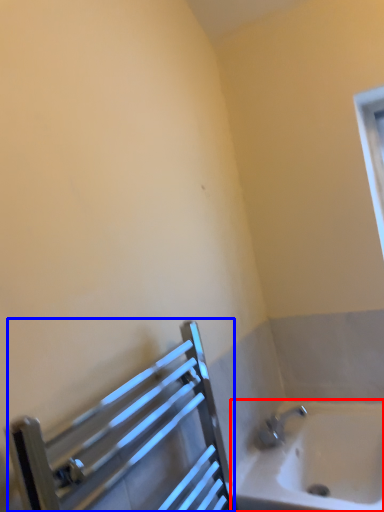
Question: Which object appears closest to the camera in this image, bathtub (highlighted by a red box) or balustrade (highlighted by a blue box)?

Choices:
 (A) bathtub
 (B) balustrade

Answer: (B)